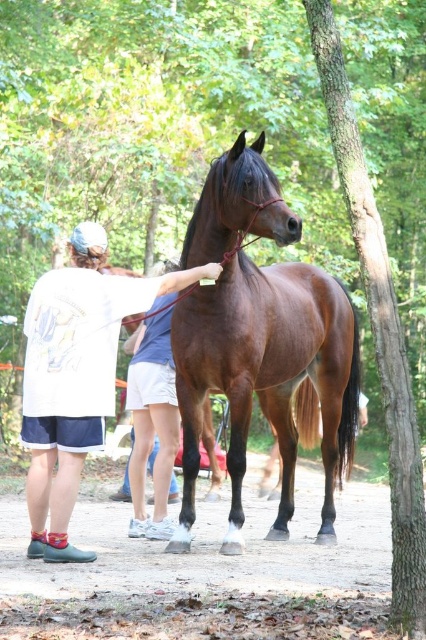
Question: Among these objects, which one is farthest from the camera?

Choices:
 (A) white cotton shirt at left
 (B) brown glossy horse at center

Answer: (A)

Question: Can you confirm if brown glossy horse at center is thinner than white cotton shirt at left?

Choices:
 (A) no
 (B) yes

Answer: (A)

Question: Which of the following is the farthest from the observer?

Choices:
 (A) (281, 388)
 (B) (43, 518)

Answer: (A)

Question: Does brown glossy horse at center have a smaller size compared to white cotton shirt at left?

Choices:
 (A) yes
 (B) no

Answer: (B)

Question: Does brown glossy horse at center have a greater width compared to white cotton shirt at left?

Choices:
 (A) no
 (B) yes

Answer: (B)